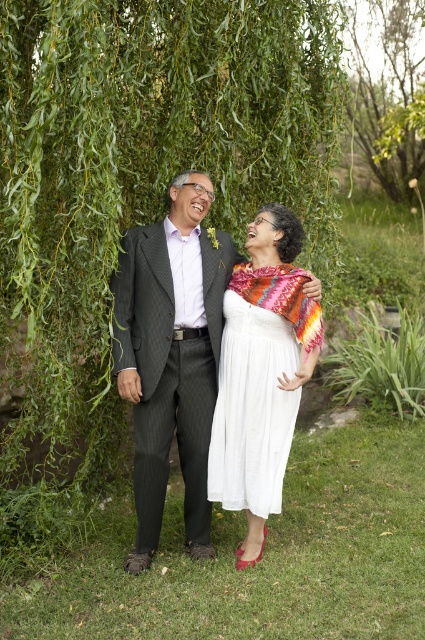
Question: Estimate the real-world distances between objects in this image. Which object is farther from the white cotton dress at center?

Choices:
 (A) multicolored woven shawl at center
 (B) white satin dress at center
 (C) green leafy willow at upper left

Answer: (C)

Question: Which point is closer to the camera?

Choices:
 (A) white satin dress at center
 (B) white cotton dress at center
 (C) multicolored woven shawl at center
 (D) green leafy tree at upper center

Answer: (C)

Question: Does green leafy willow at upper left appear on the left side of white satin dress at center?

Choices:
 (A) yes
 (B) no

Answer: (A)

Question: Does white cotton dress at center have a lesser width compared to green leafy tree at upper center?

Choices:
 (A) yes
 (B) no

Answer: (A)

Question: Which of these objects is positioned farthest from the white cotton dress at center?

Choices:
 (A) green leafy tree at upper center
 (B) white satin dress at center
 (C) green leafy willow at upper left
 (D) multicolored woven shawl at center

Answer: (A)

Question: Can you confirm if white satin dress at center is bigger than green leafy tree at upper center?

Choices:
 (A) no
 (B) yes

Answer: (A)